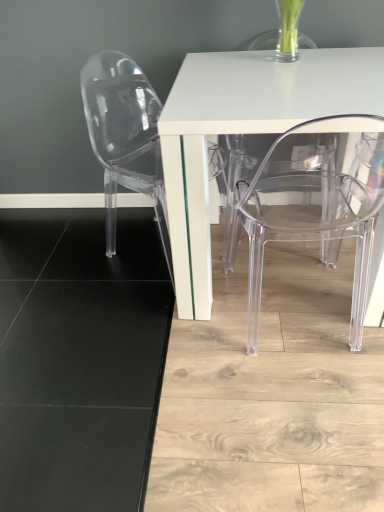
Locate an element on the screen. Image resolution: width=384 pixels, height=512 pixels. free spot below white glossy table at center (from a real-world perspective) is located at coordinates (290, 259).